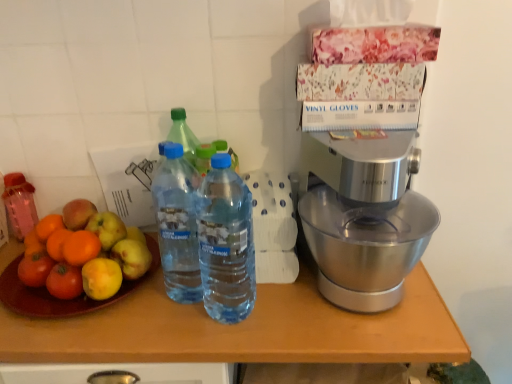
At what (x,y) coordinates should I click in order to perform the action: click on free space above silver metallic mixer at right (from a real-world perspective). Please return your answer as a coordinate pair (x, y). Image resolution: width=512 pixels, height=384 pixels. Looking at the image, I should click on (369, 139).